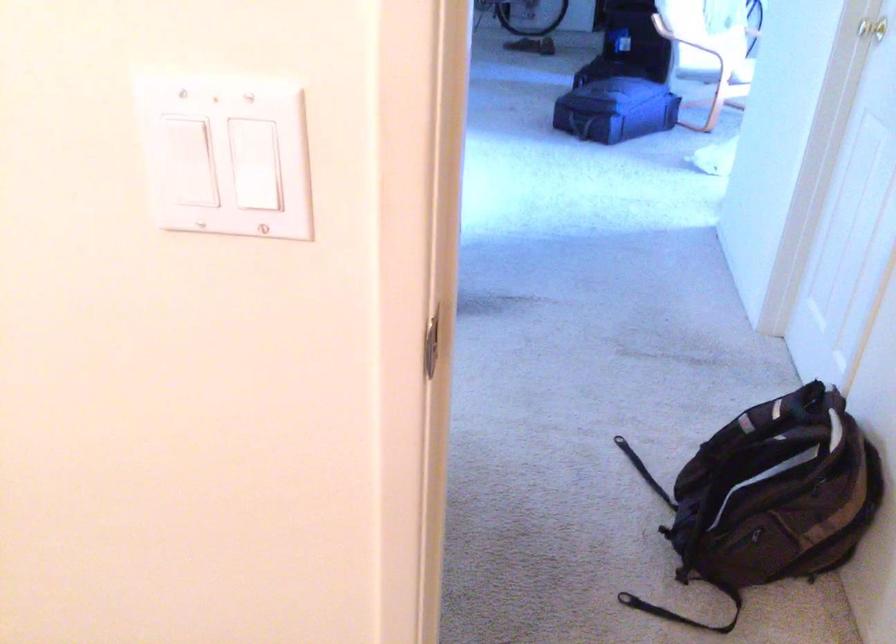
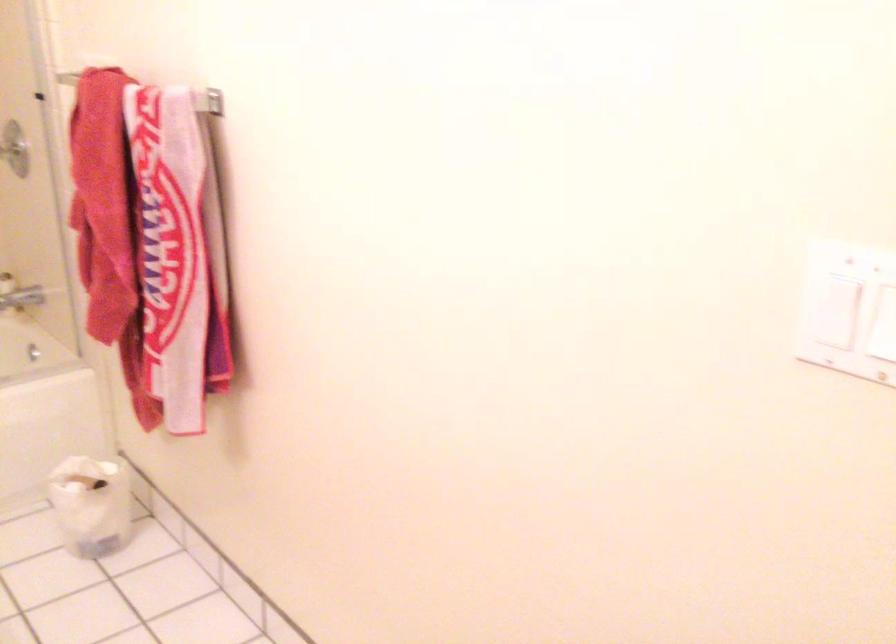
Question: The first image is from the beginning of the video and the second image is from the end. How did the camera likely rotate when shooting the video?

Choices:
 (A) Left
 (B) Right
 (C) Up
 (D) Down

Answer: (A)